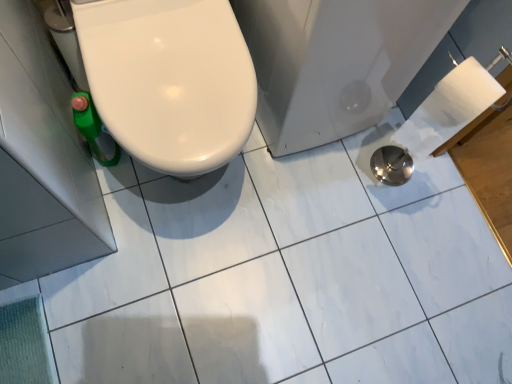
Where is `metallic silver bath at lower right`? The width and height of the screenshot is (512, 384). metallic silver bath at lower right is located at coordinates (335, 62).

The height and width of the screenshot is (384, 512). What do you see at coordinates (335, 62) in the screenshot?
I see `metallic silver bath at lower right` at bounding box center [335, 62].

Describe the element at coordinates (169, 80) in the screenshot. I see `white glossy toilet at left` at that location.

At what (x,y) coordinates should I click in order to perform the action: click on white glossy toilet at left. Please return your answer as a coordinate pair (x, y). Image resolution: width=512 pixels, height=384 pixels. Looking at the image, I should click on (169, 80).

Measure the distance between point (184, 6) and camera.

39.13 inches.

The image size is (512, 384). What are the coordinates of `metallic silver bath at lower right` in the screenshot? It's located at (335, 62).

Considering the relative positions of metallic silver bath at lower right and white glossy toilet at left in the image provided, is metallic silver bath at lower right to the right of white glossy toilet at left from the viewer's perspective?

Correct, you'll find metallic silver bath at lower right to the right of white glossy toilet at left.

Considering the positions of objects metallic silver bath at lower right and white glossy toilet at left in the image provided, who is in front, metallic silver bath at lower right or white glossy toilet at left?

white glossy toilet at left is more forward.

From the picture: Which is farther from the camera, (450, 14) or (162, 117)?

The point (450, 14) is more distant.

From the image's perspective, is metallic silver bath at lower right located above white glossy toilet at left?

Yes, from the image's perspective, metallic silver bath at lower right is over white glossy toilet at left.

From a real-world perspective, which object stands above the other?

white glossy toilet at left.

Can you confirm if metallic silver bath at lower right is wider than white glossy toilet at left?

Correct, the width of metallic silver bath at lower right exceeds that of white glossy toilet at left.

Considering the relative sizes of metallic silver bath at lower right and white glossy toilet at left in the image provided, is metallic silver bath at lower right taller than white glossy toilet at left?

No.

Considering the relative sizes of metallic silver bath at lower right and white glossy toilet at left in the image provided, is metallic silver bath at lower right bigger than white glossy toilet at left?

Yes, metallic silver bath at lower right is bigger than white glossy toilet at left.

From the picture: Is metallic silver bath at lower right spatially inside white glossy toilet at left, or outside of it?

metallic silver bath at lower right is located beyond the bounds of white glossy toilet at left.

Are metallic silver bath at lower right and white glossy toilet at left making contact?

metallic silver bath at lower right and white glossy toilet at left are clearly separated.

Could you tell me if metallic silver bath at lower right is turned towards white glossy toilet at left?

No, metallic silver bath at lower right does not turn towards white glossy toilet at left.

How many degrees apart are the facing directions of metallic silver bath at lower right and white glossy toilet at left?

The angle between the facing direction of metallic silver bath at lower right and the facing direction of white glossy toilet at left is 1.95 degrees.

In the image, there is a white glossy toilet at left. At what (x,y) coordinates should I click in order to perform the action: click on bath below it (from a real-world perspective). Please return your answer as a coordinate pair (x, y). This screenshot has width=512, height=384. Looking at the image, I should click on (335, 62).

Considering the relative positions of white glossy toilet at left and metallic silver bath at lower right in the image provided, is white glossy toilet at left to the left or to the right of metallic silver bath at lower right?

Clearly, white glossy toilet at left is on the left of metallic silver bath at lower right in the image.

Which object is further away from the camera, white glossy toilet at left or metallic silver bath at lower right?

metallic silver bath at lower right is more distant.

Does point (138, 139) lie behind point (298, 76)?

No, it is in front of (298, 76).

From the image's perspective, is white glossy toilet at left positioned above or below metallic silver bath at lower right?

white glossy toilet at left is situated lower than metallic silver bath at lower right in the image.

From a real-world perspective, which object stands above the other?

white glossy toilet at left is physically above.

Looking at their sizes, would you say white glossy toilet at left is wider or thinner than metallic silver bath at lower right?

white glossy toilet at left is thinner than metallic silver bath at lower right.

Can you confirm if white glossy toilet at left is taller than metallic silver bath at lower right?

Yes, white glossy toilet at left is taller than metallic silver bath at lower right.

Considering the sizes of white glossy toilet at left and metallic silver bath at lower right in the image, is white glossy toilet at left bigger or smaller than metallic silver bath at lower right?

Considering their sizes, white glossy toilet at left takes up less space than metallic silver bath at lower right.

Looking at this image, does white glossy toilet at left contain metallic silver bath at lower right?

No.

Are white glossy toilet at left and metallic silver bath at lower right beside each other?

white glossy toilet at left and metallic silver bath at lower right are not in contact.

Is white glossy toilet at left aimed at metallic silver bath at lower right?

No, white glossy toilet at left is not facing towards metallic silver bath at lower right.

How different are the orientations of white glossy toilet at left and metallic silver bath at lower right in degrees?

They differ by 1.95 degrees in their facing directions.

You are a GUI agent. You are given a task and a screenshot of the screen. Output one action in this format:
    pyautogui.click(x=<x>, y=<y>)
    Task: Click on the bath on the right of the white glossy toilet at left
    The width and height of the screenshot is (512, 384).
    Given the screenshot: What is the action you would take?
    pyautogui.click(x=335, y=62)

Find the location of a particular element. This screenshot has height=384, width=512. bath on the right side of white glossy toilet at left is located at coordinates (335, 62).

Locate an element on the screen. This screenshot has width=512, height=384. bath behind the white glossy toilet at left is located at coordinates (335, 62).